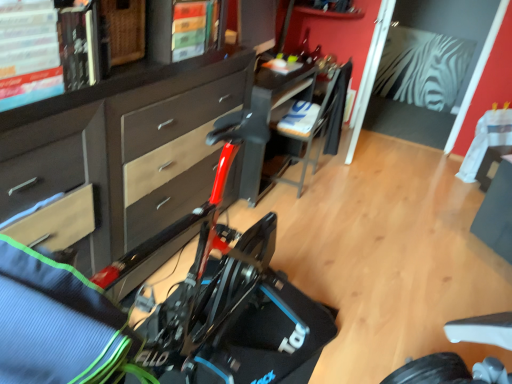
Question: Is matte brown cabinet at center closer to camera compared to black plastic chair at center?

Choices:
 (A) yes
 (B) no

Answer: (A)

Question: Could you tell me if matte brown cabinet at center is facing black plastic chair at center?

Choices:
 (A) no
 (B) yes

Answer: (A)

Question: Does matte brown cabinet at center have a lesser width compared to black plastic chair at center?

Choices:
 (A) no
 (B) yes

Answer: (B)

Question: Does matte brown cabinet at center have a greater width compared to black plastic chair at center?

Choices:
 (A) yes
 (B) no

Answer: (B)

Question: Considering the relative positions of matte brown cabinet at center and black plastic chair at center in the image provided, is matte brown cabinet at center behind black plastic chair at center?

Choices:
 (A) yes
 (B) no

Answer: (B)

Question: From a real-world perspective, is matte brown cabinet at center positioned over black plastic chair at center based on gravity?

Choices:
 (A) yes
 (B) no

Answer: (A)

Question: Is black plastic chair at center far from matte brown cabinet at center?

Choices:
 (A) yes
 (B) no

Answer: (A)

Question: Is black plastic chair at center facing towards matte brown cabinet at center?

Choices:
 (A) yes
 (B) no

Answer: (B)

Question: Is black plastic chair at center next to matte brown cabinet at center and touching it?

Choices:
 (A) no
 (B) yes

Answer: (A)

Question: Is black plastic chair at center shorter than matte brown cabinet at center?

Choices:
 (A) yes
 (B) no

Answer: (A)

Question: Considering the relative sizes of black plastic chair at center and matte brown cabinet at center in the image provided, is black plastic chair at center thinner than matte brown cabinet at center?

Choices:
 (A) yes
 (B) no

Answer: (B)

Question: Is black plastic chair at center further to the viewer compared to matte brown cabinet at center?

Choices:
 (A) no
 (B) yes

Answer: (B)

Question: Is matte brown cabinet at center bigger than black plastic table at center?

Choices:
 (A) yes
 (B) no

Answer: (A)